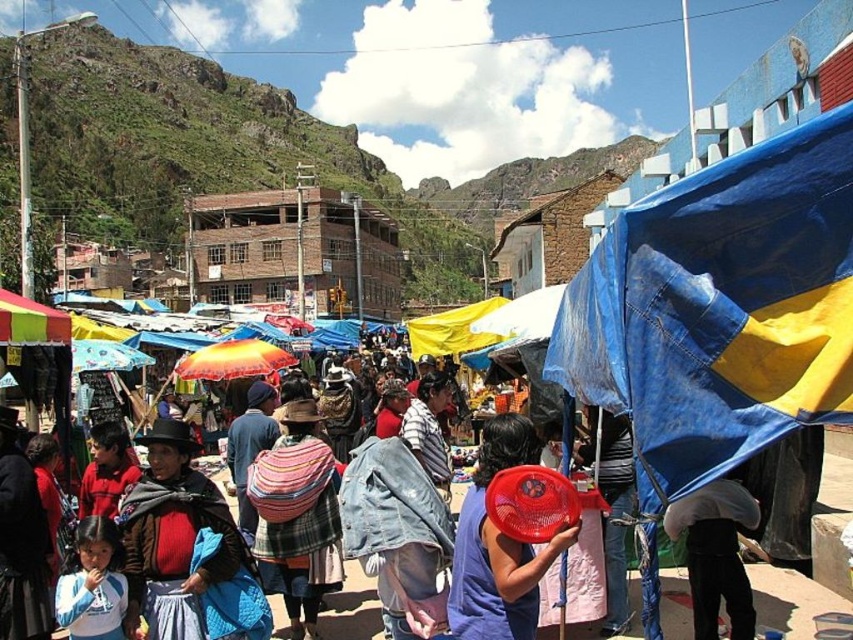
Can you confirm if knitted wool sweater at center is positioned to the left of light blue fabric at lower left?

Incorrect, knitted wool sweater at center is not on the left side of light blue fabric at lower left.

Describe the element at coordinates (186, 548) in the screenshot. I see `knitted wool sweater at center` at that location.

Who is more forward, (173, 504) or (80, 634)?

Positioned in front is point (80, 634).

Locate an element on the screen. knitted wool sweater at center is located at coordinates (186, 548).

Which of these two, matte red fan at center or yellow fabric canopy at left, stands taller?

With more height is matte red fan at center.

Between point (463, 589) and point (42, 305), which one is positioned in front?

Point (463, 589) is more forward.

Is point (461, 509) behind point (36, 332)?

No.

The width and height of the screenshot is (853, 640). What are the coordinates of `matte red fan at center` in the screenshot? It's located at (498, 547).

Can you confirm if plaid woolen shawl at center is positioned to the left of orange fabric umbrella at center?

No, plaid woolen shawl at center is not to the left of orange fabric umbrella at center.

Is plaid woolen shawl at center further to camera compared to orange fabric umbrella at center?

No, it is in front of orange fabric umbrella at center.

Locate an element on the screen. The height and width of the screenshot is (640, 853). plaid woolen shawl at center is located at coordinates (297, 516).